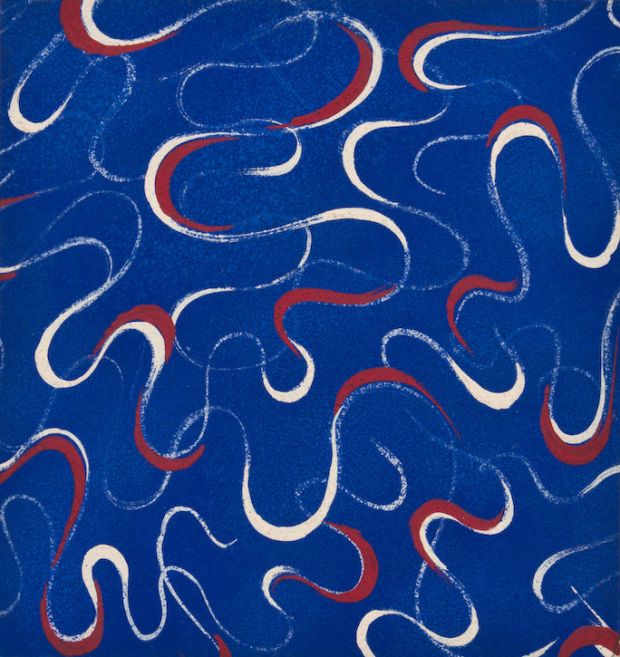
I want to click on paint, so click(215, 357), click(451, 472), click(567, 447).